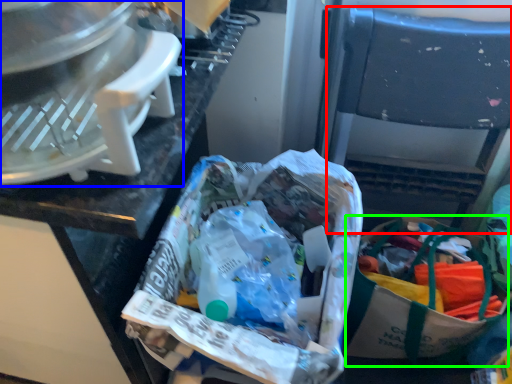
Question: Which object is the farthest from folding chair (highlighted by a red box)? Choose among these: kitchen appliance (highlighted by a blue box) or shopping bag (highlighted by a green box).

Choices:
 (A) kitchen appliance
 (B) shopping bag

Answer: (A)